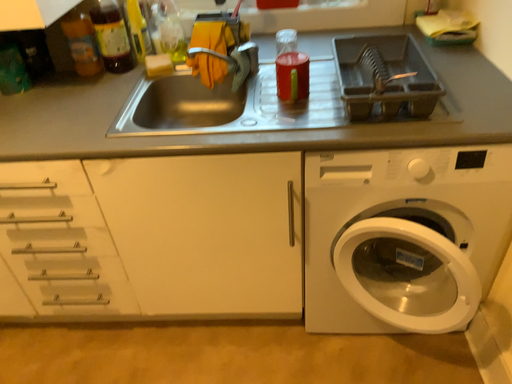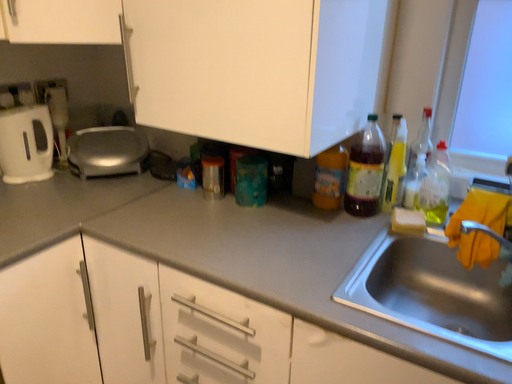
Question: How did the camera likely rotate when shooting the video?

Choices:
 (A) rotated right
 (B) rotated left

Answer: (B)